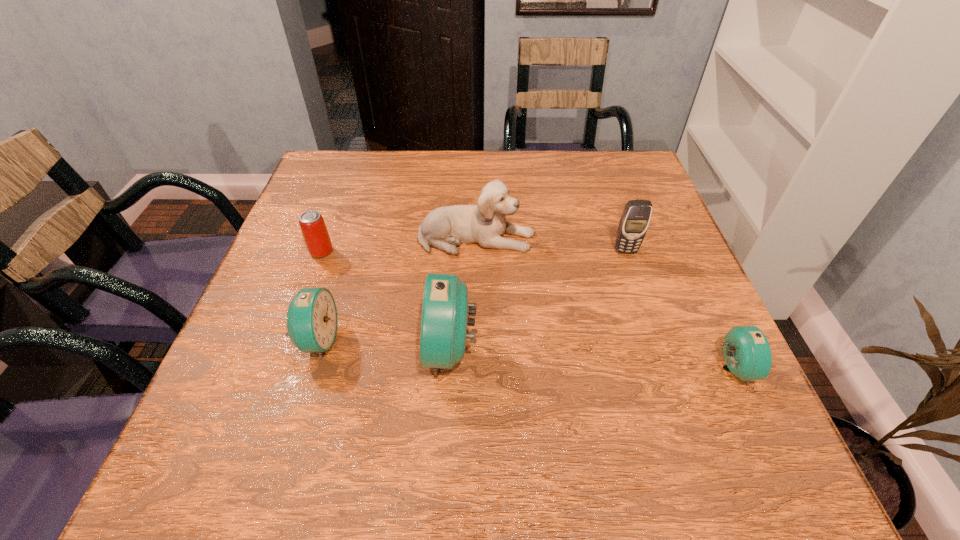
Identify the location of free area in between the beer can and the fifth object from left to right. (473, 252).

Where is `blank region between the beer can and the fifth object from left to right`? The height and width of the screenshot is (540, 960). blank region between the beer can and the fifth object from left to right is located at coordinates (473, 252).

Identify the location of free space between the leftmost alarm clock and the tallest object. (385, 345).

The image size is (960, 540). Find the location of `vacant space that is in between the shortest alarm clock and the beer can`. vacant space that is in between the shortest alarm clock and the beer can is located at coordinates (527, 310).

Locate an element on the screen. vacant point located between the second object from right to left and the second shortest alarm clock is located at coordinates (471, 295).

Where is `empty location between the beer can and the fifth object from left to right`? empty location between the beer can and the fifth object from left to right is located at coordinates (473, 252).

Image resolution: width=960 pixels, height=540 pixels. In order to click on free space between the leftmost alarm clock and the shortest alarm clock in this screenshot , I will do `click(525, 354)`.

Find the location of a particular element. vacant area that lies between the beer can and the cellular telephone is located at coordinates (473, 252).

Locate an element on the screen. The height and width of the screenshot is (540, 960). object that stands as the fifth closest to the fifth object from left to right is located at coordinates [x=315, y=233].

Find the location of a particular element. object that stands as the fourth closest to the shortest alarm clock is located at coordinates (312, 314).